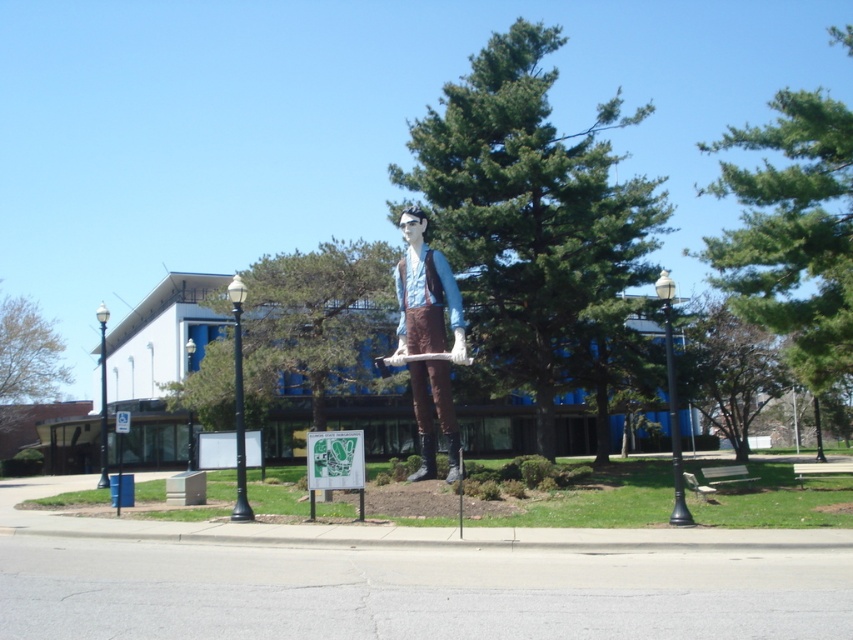
You are standing in the park and want to take a photo of the statue. The statue is at the center of the park. You notice a point at coordinates (531, 216). What object is located at that point?

The point at coordinates (531, 216) corresponds to the green textured tree at center.

You are a park maintenance worker who needs to trim branches that are hanging over the statue. Which tree, the green textured tree at center or the green leafy tree at upper right, is taller and therefore more likely to have branches over the statue?

The green leafy tree at upper right is taller than the green textured tree at center, so it is more likely to have branches over the statue.